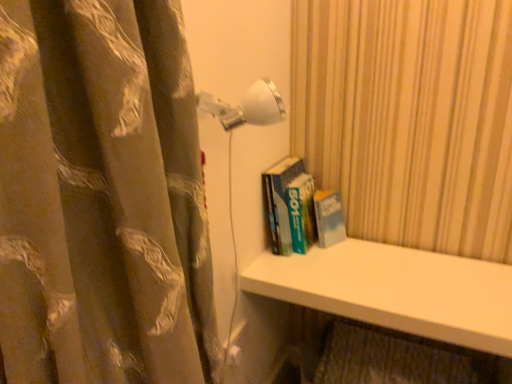
Question: Is white glossy wall lamp at upper center in contact with white smooth shelf at lower center?

Choices:
 (A) yes
 (B) no

Answer: (B)

Question: Is white glossy wall lamp at upper center smaller than white smooth shelf at lower center?

Choices:
 (A) no
 (B) yes

Answer: (B)

Question: Does white glossy wall lamp at upper center turn towards white smooth shelf at lower center?

Choices:
 (A) no
 (B) yes

Answer: (A)

Question: Can you confirm if white glossy wall lamp at upper center is bigger than white smooth shelf at lower center?

Choices:
 (A) yes
 (B) no

Answer: (B)

Question: Is white glossy wall lamp at upper center far away from white smooth shelf at lower center?

Choices:
 (A) yes
 (B) no

Answer: (B)

Question: Considering the relative sizes of white glossy wall lamp at upper center and white smooth shelf at lower center in the image provided, is white glossy wall lamp at upper center thinner than white smooth shelf at lower center?

Choices:
 (A) no
 (B) yes

Answer: (B)

Question: Is hardcover book at center wider than white glossy wall lamp at upper center?

Choices:
 (A) yes
 (B) no

Answer: (A)

Question: Is hardcover book at center bigger than white glossy wall lamp at upper center?

Choices:
 (A) yes
 (B) no

Answer: (A)

Question: Considering the relative sizes of hardcover book at center and white glossy wall lamp at upper center in the image provided, is hardcover book at center thinner than white glossy wall lamp at upper center?

Choices:
 (A) yes
 (B) no

Answer: (B)

Question: From the image's perspective, is hardcover book at center on top of white glossy wall lamp at upper center?

Choices:
 (A) yes
 (B) no

Answer: (B)

Question: Is hardcover book at center facing towards white glossy wall lamp at upper center?

Choices:
 (A) yes
 (B) no

Answer: (B)

Question: From a real-world perspective, is hardcover book at center under white glossy wall lamp at upper center?

Choices:
 (A) yes
 (B) no

Answer: (A)

Question: Does brown floral fabric curtain at left lie behind white glossy wall lamp at upper center?

Choices:
 (A) yes
 (B) no

Answer: (B)